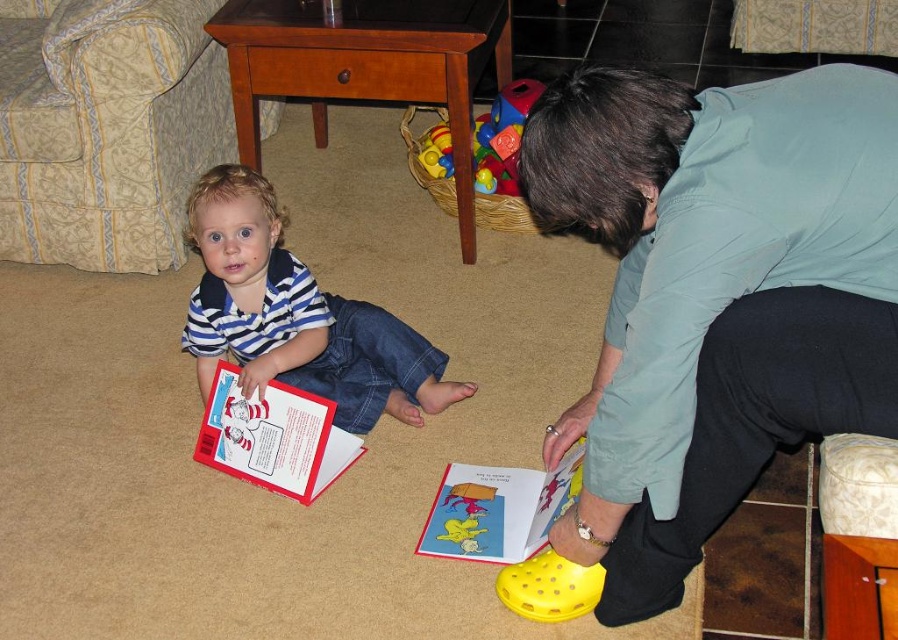
Question: Which point is closer to the camera?

Choices:
 (A) rubberized plastic toy at center
 (B) striped cotton shirt at center
 (C) hardcover book at lower center

Answer: (C)

Question: Estimate the real-world distances between objects in this image. Which object is farther from the striped cotton shirt at center?

Choices:
 (A) rubberized plastic toy at center
 (B) hardcover book at center
 (C) hardcover book at lower center

Answer: (A)

Question: Is the position of hardcover book at center more distant than that of rubberized plastic toy at center?

Choices:
 (A) yes
 (B) no

Answer: (B)

Question: Which point is farther to the camera?

Choices:
 (A) striped cotton shirt at center
 (B) rubberized plastic toy at center
 (C) hardcover book at lower center

Answer: (B)

Question: Does striped cotton shirt at center have a lesser width compared to rubberized plastic toy at center?

Choices:
 (A) yes
 (B) no

Answer: (B)

Question: From the image, what is the correct spatial relationship of hardcover book at lower center in relation to rubberized plastic toy at center?

Choices:
 (A) below
 (B) above

Answer: (A)